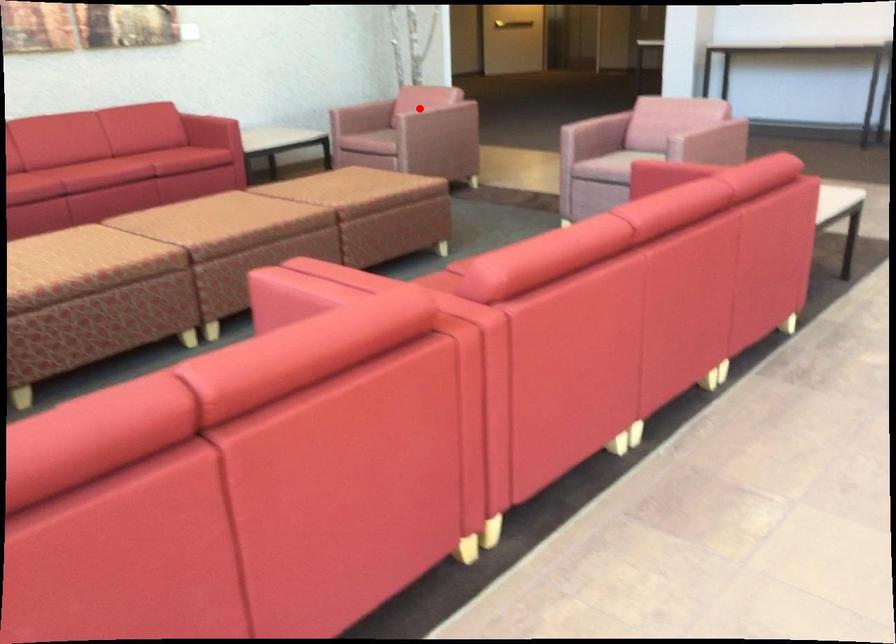
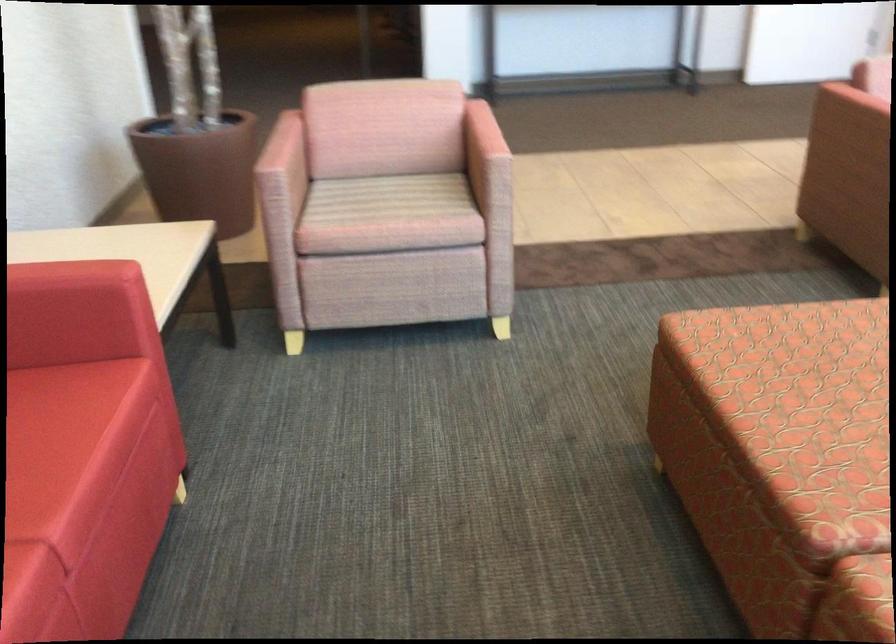
Question: I am providing you with two images of the same scene from different viewpoints. Image1 has a red point marked. In image2, the corresponding 3D location appears at what relative position? Reply with the corresponding letter.

Choices:
 (A) Closer
 (B) Farther

Answer: (A)